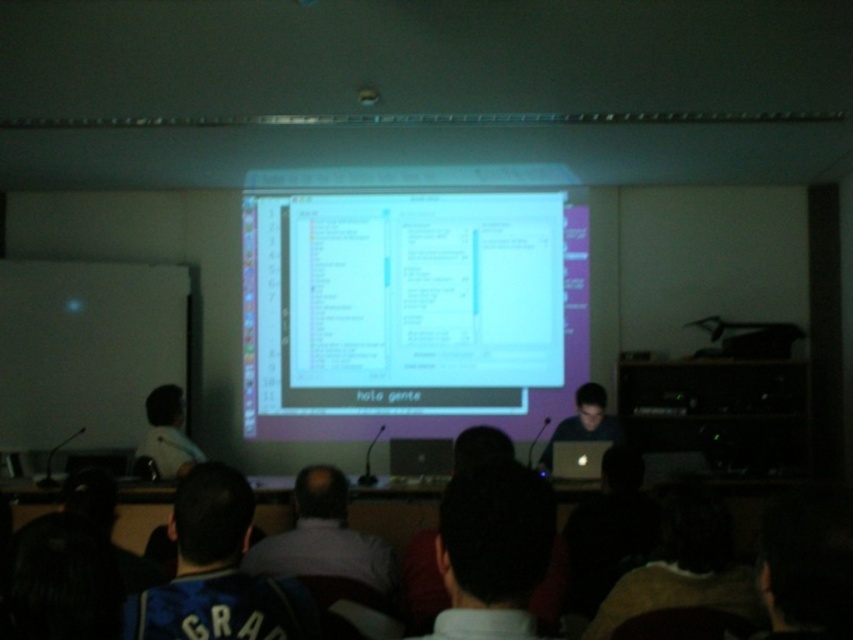
Question: Estimate the real-world distances between objects in this image. Which object is farther from the white matte shirt at center?

Choices:
 (A) white glossy projector screen at center
 (B) light gray shirt at left
 (C) blue jersey at lower left
 (D) black matte laptop at center

Answer: (A)

Question: Among these points, which one is farthest from the camera?

Choices:
 (A) (349, 220)
 (B) (352, 557)
 (C) (178, 474)

Answer: (A)

Question: Is white glossy projector screen at center above white matte shirt at center?

Choices:
 (A) yes
 (B) no

Answer: (A)

Question: Which of the following is the closest to the observer?

Choices:
 (A) black matte laptop at center
 (B) white glossy projector screen at center
 (C) blue jersey at lower left

Answer: (C)

Question: Does light gray shirt at left have a greater width compared to black matte laptop at center?

Choices:
 (A) no
 (B) yes

Answer: (A)

Question: Can you confirm if blue jersey at lower left is thinner than light gray shirt at left?

Choices:
 (A) yes
 (B) no

Answer: (A)